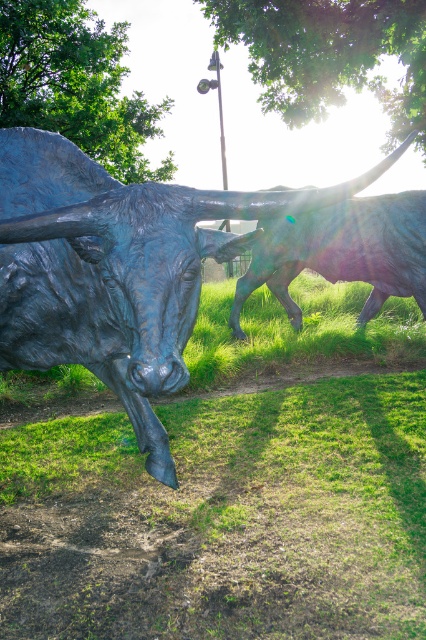
Question: Is green grass at center closer to the viewer compared to bronze textured bull at left?

Choices:
 (A) no
 (B) yes

Answer: (A)

Question: Does green grass at center appear over bronze textured bull at left?

Choices:
 (A) yes
 (B) no

Answer: (B)

Question: Which is nearer to the green grass at center?

Choices:
 (A) shiny bronze bull at center
 (B) bronze textured bull at left

Answer: (B)

Question: Is green grass at center to the right of bronze textured bull at left from the viewer's perspective?

Choices:
 (A) yes
 (B) no

Answer: (B)

Question: Which object is positioned closest to the bronze textured bull at left?

Choices:
 (A) shiny bronze bull at center
 (B) green grass at center

Answer: (B)

Question: Among these objects, which one is farthest from the camera?

Choices:
 (A) green grass at center
 (B) shiny bronze bull at center

Answer: (B)